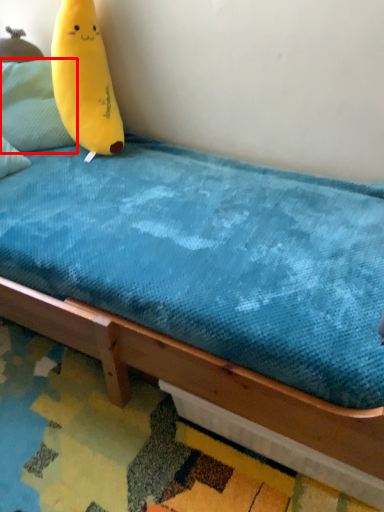
Question: From the image, what is the correct spatial relationship of pillow (annotated by the red box) in relation to banana?

Choices:
 (A) right
 (B) left

Answer: (B)